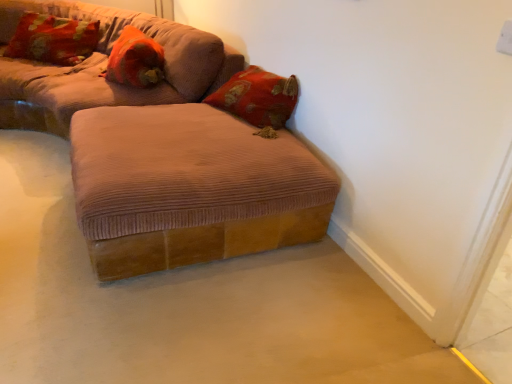
Question: Is velvet floral pillow at upper left, positioned as the 2th pillow in right-to-left order, in front of or behind brown corduroy ottoman at center in the image?

Choices:
 (A) behind
 (B) front

Answer: (A)

Question: In terms of height, does velvet floral pillow at upper left, which is the 1th pillow in left-to-right order, look taller or shorter compared to brown corduroy ottoman at center?

Choices:
 (A) tall
 (B) short

Answer: (A)

Question: Which of these objects is positioned closest to the orange corduroy pillow at upper left, marked as the 1th pillow in a right-to-left arrangement?

Choices:
 (A) corduroy brown ottoman at center, marked as the 1th studio couch in a top-to-bottom arrangement
 (B) corduroy brown ottoman at lower center, positioned as the second studio couch in top-to-bottom order
 (C) velvet floral pillow at upper left, which is the 1th pillow in left-to-right order
 (D) brown corduroy ottoman at center

Answer: (A)

Question: Estimate the real-world distances between objects in this image. Which object is farther from the corduroy brown ottoman at center, which is counted as the second studio couch, starting from the bottom?

Choices:
 (A) brown corduroy ottoman at center
 (B) velvet floral pillow at upper left, which is the 1th pillow in left-to-right order
 (C) orange corduroy pillow at upper left, arranged as the second pillow when viewed from the left
 (D) corduroy brown ottoman at lower center, positioned as the second studio couch in top-to-bottom order

Answer: (A)